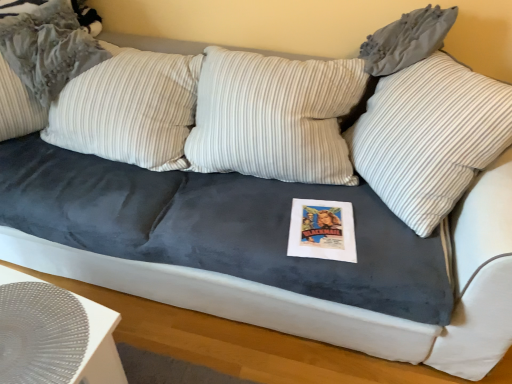
Question: Is striped fabric pillow at upper left, which is the 1th pillow in left-to-right order, positioned beyond the bounds of white striped pillow at upper center, the 1th pillow when ordered from right to left?

Choices:
 (A) no
 (B) yes

Answer: (B)

Question: From the image's perspective, does striped fabric pillow at upper left, the 2th pillow from the right, appear lower than white striped pillow at upper center, the 1th pillow when ordered from right to left?

Choices:
 (A) no
 (B) yes

Answer: (A)

Question: Is the position of striped fabric pillow at upper left, the 2th pillow from the right, more distant than that of white striped pillow at upper center, the second pillow when ordered from left to right?

Choices:
 (A) yes
 (B) no

Answer: (A)

Question: Could white striped pillow at upper center, the second pillow when ordered from left to right, be considered to be inside striped fabric pillow at upper left, the 2th pillow from the right?

Choices:
 (A) yes
 (B) no

Answer: (B)

Question: Is striped fabric pillow at upper left, which is the 1th pillow in left-to-right order, bigger than white striped pillow at upper center, the 1th pillow when ordered from right to left?

Choices:
 (A) no
 (B) yes

Answer: (A)

Question: Can you confirm if striped fabric pillow at upper left, the 2th pillow from the right, is taller than white striped pillow at upper center, the 1th pillow when ordered from right to left?

Choices:
 (A) no
 (B) yes

Answer: (A)

Question: Does white striped pillow at upper center, the 1th pillow when ordered from right to left, have a smaller size compared to white textured placemat at lower left?

Choices:
 (A) yes
 (B) no

Answer: (B)

Question: Can you confirm if white striped pillow at upper center, the 1th pillow when ordered from right to left, is positioned to the right of white textured placemat at lower left?

Choices:
 (A) no
 (B) yes

Answer: (B)

Question: From the image's perspective, does white striped pillow at upper center, the 1th pillow when ordered from right to left, appear higher than white textured placemat at lower left?

Choices:
 (A) no
 (B) yes

Answer: (B)

Question: From a real-world perspective, is white striped pillow at upper center, the second pillow when ordered from left to right, positioned under white textured placemat at lower left based on gravity?

Choices:
 (A) yes
 (B) no

Answer: (B)

Question: Does white striped pillow at upper center, the second pillow when ordered from left to right, touch white textured placemat at lower left?

Choices:
 (A) yes
 (B) no

Answer: (B)

Question: Is the position of white striped pillow at upper center, the second pillow when ordered from left to right, less distant than that of white textured placemat at lower left?

Choices:
 (A) yes
 (B) no

Answer: (B)

Question: From a real-world perspective, is white striped pillow at upper center, the second pillow when ordered from left to right, positioned over striped fabric pillow at upper left, which is the 1th pillow in left-to-right order, based on gravity?

Choices:
 (A) yes
 (B) no

Answer: (B)